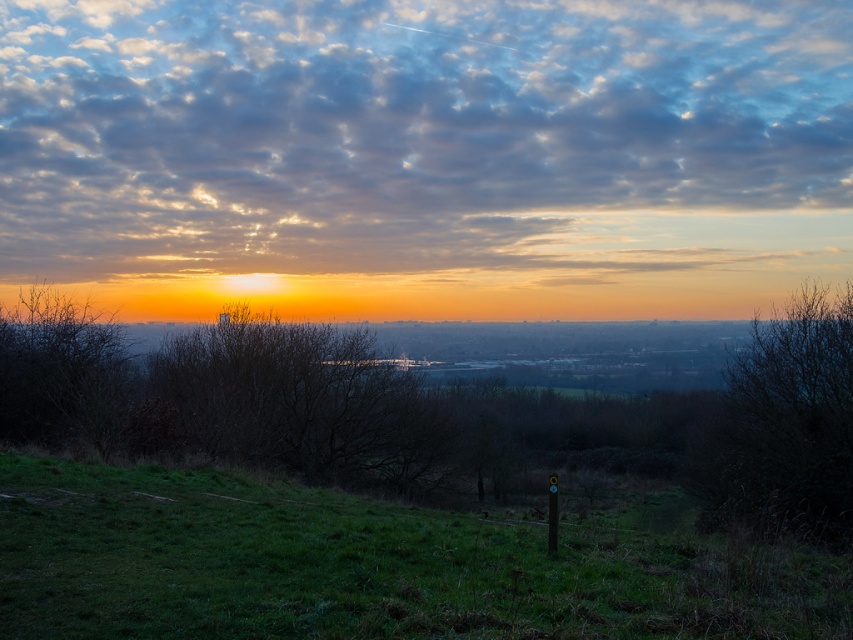
Does point (395, 573) lie in front of point (120, 342)?

Yes, point (395, 573) is in front of point (120, 342).

Who is taller, green grassy at lower center or brown matte tree at left?

brown matte tree at left

Between point (575, 531) and point (39, 348), which one is positioned behind?

The point (39, 348) is more distant.

The image size is (853, 640). In order to click on green grassy at lower center in this screenshot , I will do `click(374, 564)`.

Does green grassy at lower center lie behind brown leafless tree at right?

No, it is in front of brown leafless tree at right.

Is point (616, 577) positioned behind point (787, 461)?

No, (616, 577) is closer to viewer.

Is point (20, 536) behind point (730, 376)?

No, (20, 536) is closer to viewer.

Where is `green grassy at lower center`? Image resolution: width=853 pixels, height=640 pixels. green grassy at lower center is located at coordinates (374, 564).

Does brown leafless tree at right have a greater width compared to brown matte tree at left?

In fact, brown leafless tree at right might be narrower than brown matte tree at left.

Measure the distance between point (791, 467) and camera.

The distance of point (791, 467) from camera is 18.99 meters.

Find the location of a particular element. Image resolution: width=853 pixels, height=640 pixels. brown leafless tree at right is located at coordinates (785, 422).